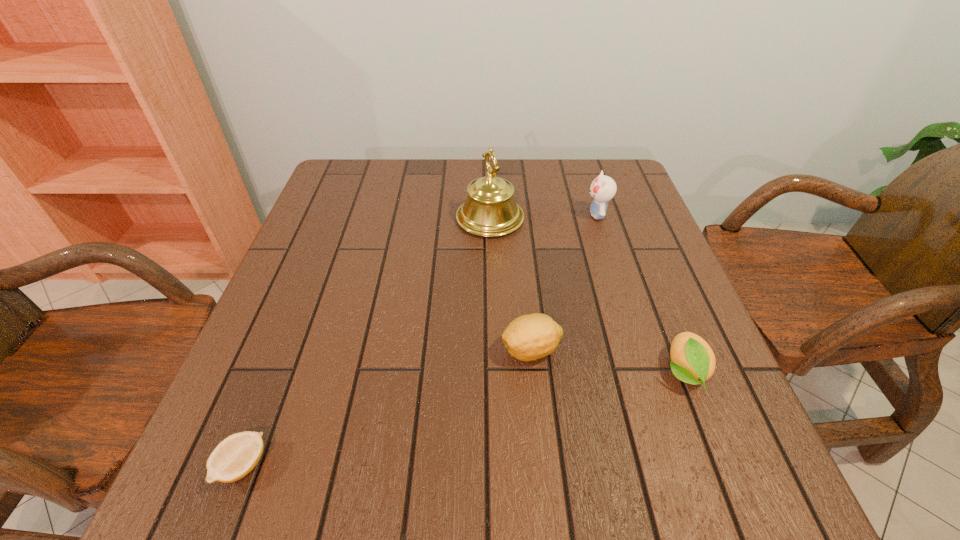
This screenshot has height=540, width=960. Identify the location of object that is at the near left corner. (236, 456).

Identify the location of vacant space at the far edge of the desktop. The image size is (960, 540). (406, 162).

Find the location of `vacant area at the left edge`. vacant area at the left edge is located at coordinates (346, 294).

This screenshot has width=960, height=540. I want to click on vacant space at the right edge of the desktop, so click(x=639, y=233).

Find the location of a particular element. Image resolution: width=960 pixels, height=540 pixels. vacant space at the far left corner of the desktop is located at coordinates (383, 174).

What are the coordinates of `vacant area between the second lemon from right to left and the rightmost lemon` in the screenshot? It's located at (608, 361).

The image size is (960, 540). Identify the location of vacant area that lies between the bell and the rightmost lemon. (587, 295).

Where is `free space between the rightmost lemon and the second lemon from left to right`? The height and width of the screenshot is (540, 960). free space between the rightmost lemon and the second lemon from left to right is located at coordinates coord(608,361).

You are a GUI agent. You are given a task and a screenshot of the screen. Output one action in this format:
    pyautogui.click(x=<x>, y=<y>)
    Task: Click on the vacant space that's between the fourth shortest object and the bell
    Image resolution: width=960 pixels, height=540 pixels.
    Given the screenshot: What is the action you would take?
    pyautogui.click(x=543, y=217)

The image size is (960, 540). What are the coordinates of `free area in between the rightmost lemon and the second lemon from right to left` in the screenshot? It's located at (608, 361).